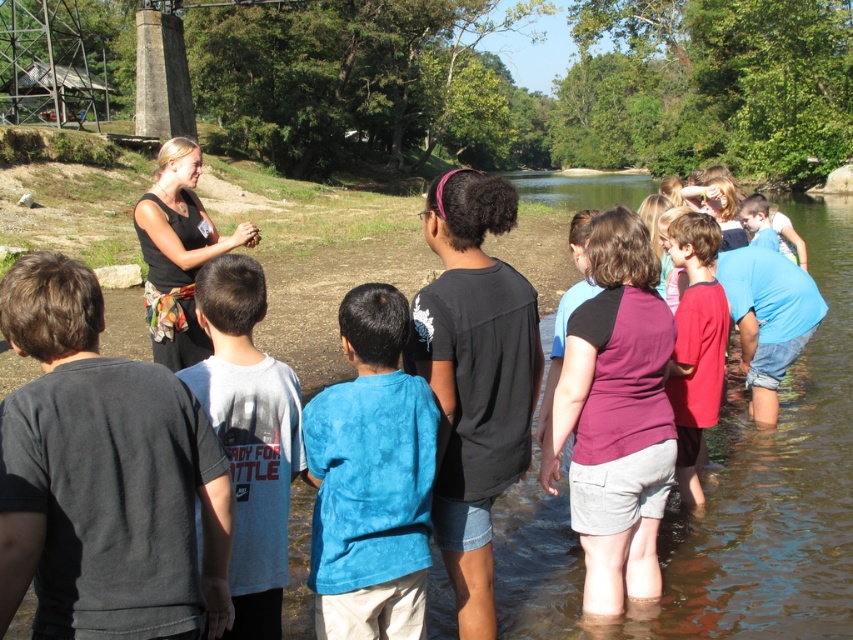
You are a photographer trying to capture a candid shot of the children in the water. You notice the dark gray cotton shirt at left and the clear water at center. Which object is closer to the camera, and why?

The clear water at center is closer to the camera because the dark gray cotton shirt at left is behind it.

In the scene shown: You are a photographer standing at the edge of the water. You want to take a photo that includes both the clear water at center and the black matte shirt at center. Given that your camera has a maximum focus range of 40 feet, will you be able to capture both subjects in focus without moving your position?

The clear water at center and black matte shirt at center are 39.30 feet apart. Since the distance between them is within the camera maximum focus range of 40 feet, you can capture both subjects in focus without moving.